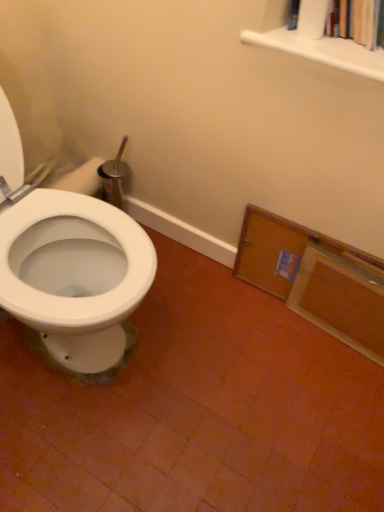
Question: Does wooden cabinet at lower right lie behind white matte bookshelf at upper right?

Choices:
 (A) no
 (B) yes

Answer: (B)

Question: Can you confirm if wooden cabinet at lower right is wider than white matte bookshelf at upper right?

Choices:
 (A) no
 (B) yes

Answer: (A)

Question: From a real-world perspective, is wooden cabinet at lower right physically above white matte bookshelf at upper right?

Choices:
 (A) yes
 (B) no

Answer: (B)

Question: From a real-world perspective, is wooden cabinet at lower right positioned under white matte bookshelf at upper right based on gravity?

Choices:
 (A) yes
 (B) no

Answer: (A)

Question: Can you confirm if wooden cabinet at lower right is shorter than white matte bookshelf at upper right?

Choices:
 (A) yes
 (B) no

Answer: (B)

Question: Is wooden cabinet at lower right in front of white matte bookshelf at upper right?

Choices:
 (A) no
 (B) yes

Answer: (A)

Question: Does white matte bookshelf at upper right have a smaller size compared to wooden cabinet at lower right?

Choices:
 (A) yes
 (B) no

Answer: (A)

Question: Does white matte bookshelf at upper right appear on the right side of wooden cabinet at lower right?

Choices:
 (A) no
 (B) yes

Answer: (B)

Question: From a real-world perspective, does white matte bookshelf at upper right stand above wooden cabinet at lower right?

Choices:
 (A) yes
 (B) no

Answer: (A)

Question: Does white matte bookshelf at upper right turn towards wooden cabinet at lower right?

Choices:
 (A) no
 (B) yes

Answer: (A)

Question: Does white matte bookshelf at upper right have a larger size compared to wooden cabinet at lower right?

Choices:
 (A) yes
 (B) no

Answer: (B)

Question: From a real-world perspective, is white matte bookshelf at upper right located beneath wooden cabinet at lower right?

Choices:
 (A) no
 (B) yes

Answer: (A)

Question: Considering the positions of point (324, 275) and point (357, 48), is point (324, 275) closer or farther from the camera than point (357, 48)?

Choices:
 (A) closer
 (B) farther

Answer: (B)